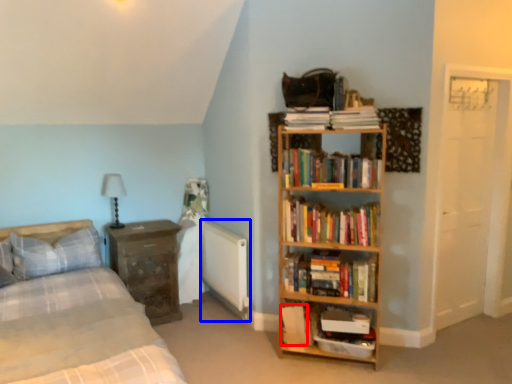
Question: Which of the following is the farthest to the observer, paperback book (highlighted by a red box) or radiator (highlighted by a blue box)?

Choices:
 (A) paperback book
 (B) radiator

Answer: (B)